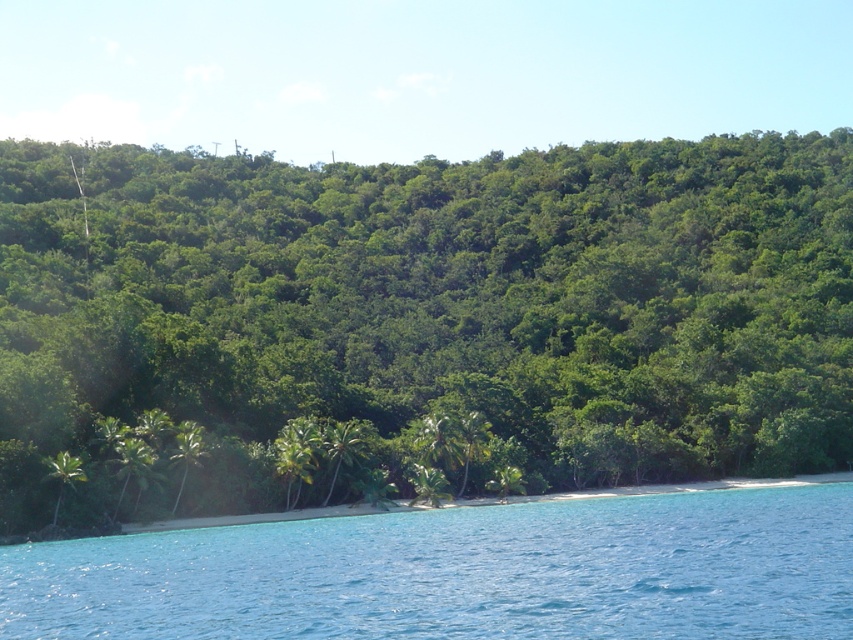
Question: In this image, where is clear blue water at lower center located relative to green leafy palm tree at lower left?

Choices:
 (A) left
 (B) right

Answer: (B)

Question: Which is farther from the green leafy palm tree at lower left?

Choices:
 (A) green leafy trees at lower center
 (B) clear blue water at lower center

Answer: (A)

Question: Which of the following is the closest to the observer?

Choices:
 (A) (57, 465)
 (B) (445, 552)
 (C) (36, 275)

Answer: (B)

Question: Is clear blue water at lower center positioned behind green leafy palm tree at lower left?

Choices:
 (A) no
 (B) yes

Answer: (A)

Question: Where is clear blue water at lower center located in relation to green leafy palm tree at lower left in the image?

Choices:
 (A) above
 (B) below

Answer: (B)

Question: Which object appears closest to the camera in this image?

Choices:
 (A) green leafy trees at lower center
 (B) clear blue water at lower center

Answer: (B)